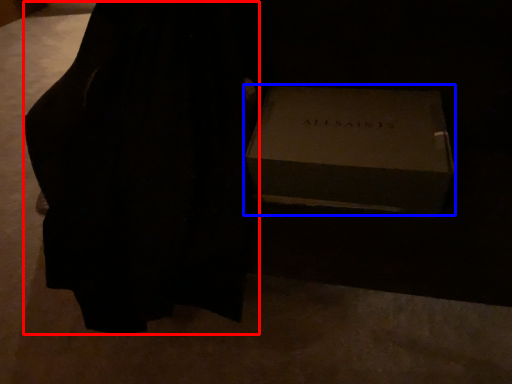
Question: Which object appears closest to the camera in this image, dress (highlighted by a red box) or box (highlighted by a blue box)?

Choices:
 (A) dress
 (B) box

Answer: (A)